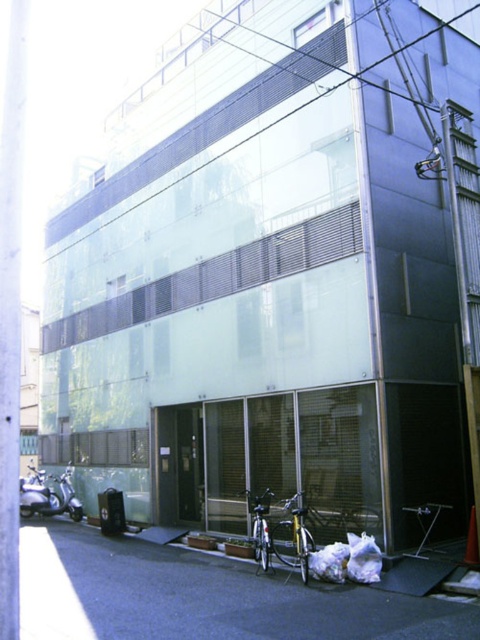
You are a delivery person who needs to load a package onto a cart. You see two bicycles, the yellow metallic bicycle at lower center and the silver metallic bicycle at lower center. Which bicycle is positioned higher up from the ground?

The yellow metallic bicycle at lower center is positioned higher up from the ground compared to the silver metallic bicycle at lower center because it is above it.

You are standing in front of the building and want to take a photo that includes both the bicycle and the stand. The bicycle is at point (x=276, y=529) and the stand is at point (x=264, y=566). Which point is closer to you so that you can focus on it first?

Point (x=264, y=566) is closer to you than point (x=276, y=529), so you should focus on point (x=264, y=566) first.

You are standing at the entrance of the building and want to park your car in the parking lot located at point 0.9, 0.6. Is the yellow metallic bicycle at lower center blocking the entrance?

The yellow metallic bicycle at lower center is positioned at point (292,536), which is very close to the parking lot at (288,576). It might be blocking the entrance depending on the exact positioning, but based on coordinates alone, it is near but not directly obstructing the entrance.